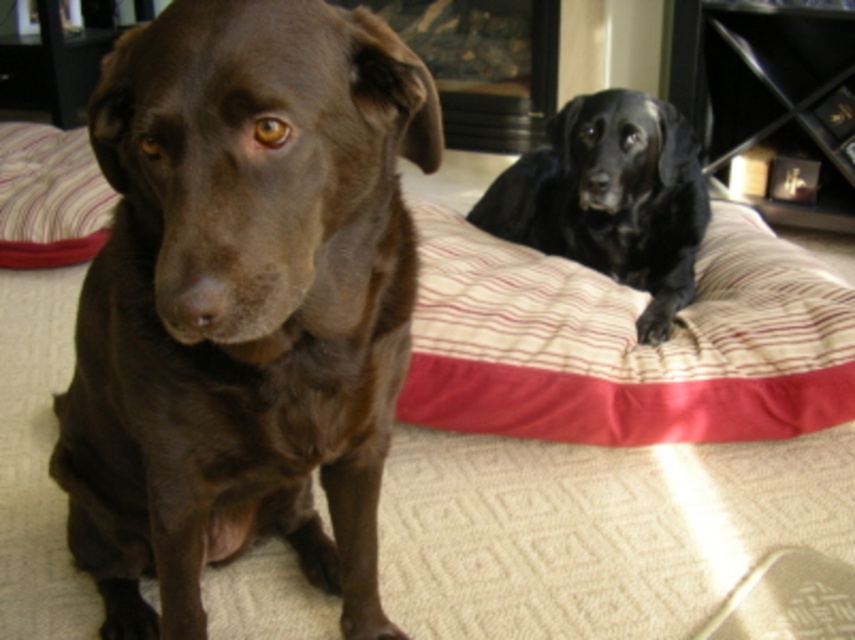
Does shiny brown dog at center appear on the right side of black glossy dog at upper right?

Incorrect, shiny brown dog at center is not on the right side of black glossy dog at upper right.

Can you confirm if shiny brown dog at center is positioned above black glossy dog at upper right?

Actually, shiny brown dog at center is below black glossy dog at upper right.

The height and width of the screenshot is (640, 855). Describe the element at coordinates (243, 301) in the screenshot. I see `shiny brown dog at center` at that location.

You are a GUI agent. You are given a task and a screenshot of the screen. Output one action in this format:
    pyautogui.click(x=<x>, y=<y>)
    Task: Click on the shiny brown dog at center
    
    Given the screenshot: What is the action you would take?
    point(243,301)

Can you confirm if shiny brown dog at center is taller than striped fabric pillow at left?

Yes.

Which is more to the left, shiny brown dog at center or striped fabric pillow at left?

From the viewer's perspective, striped fabric pillow at left appears more on the left side.

Identify the location of shiny brown dog at center. The height and width of the screenshot is (640, 855). (243, 301).

Can you confirm if black glossy dog at upper right is positioned above striped fabric pillow at left?

Incorrect, black glossy dog at upper right is not positioned above striped fabric pillow at left.

Is black glossy dog at upper right thinner than striped fabric pillow at left?

Indeed, black glossy dog at upper right has a lesser width compared to striped fabric pillow at left.

Who is more forward, (508, 228) or (62, 218)?

Positioned in front is point (508, 228).

Find the location of a particular element. The width and height of the screenshot is (855, 640). black glossy dog at upper right is located at coordinates (610, 198).